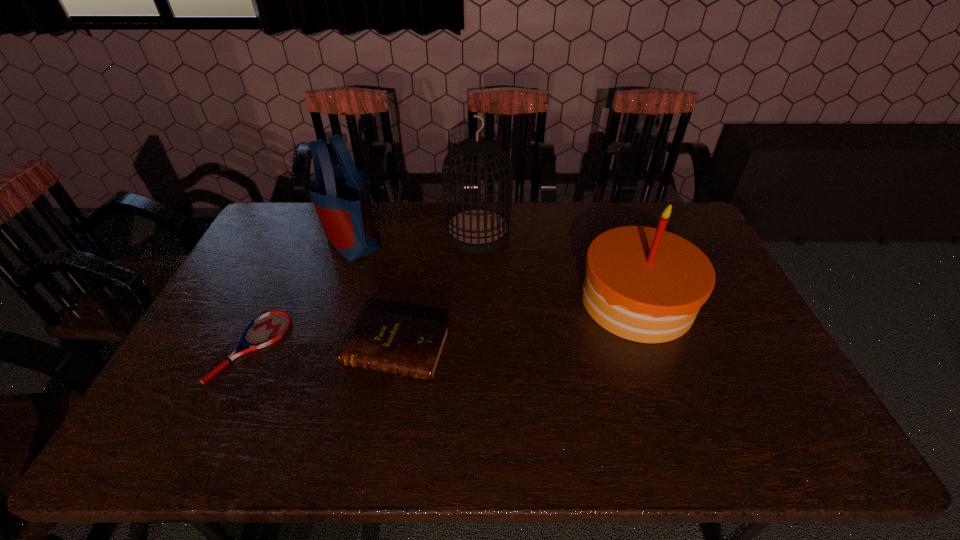
At what (x,y) coordinates should I click in order to perform the action: click on birdcage that is at the far edge. Please return your answer as a coordinate pair (x, y). Image resolution: width=960 pixels, height=540 pixels. Looking at the image, I should click on [479, 230].

This screenshot has height=540, width=960. What are the coordinates of `handbag situated at the far edge` in the screenshot? It's located at click(340, 195).

At what (x,y) coordinates should I click in order to perform the action: click on object situated at the left edge. Please return your answer as a coordinate pair (x, y). Looking at the image, I should click on (266, 329).

I want to click on object that is at the right edge, so click(644, 284).

The width and height of the screenshot is (960, 540). I want to click on free space at the far edge of the desktop, so click(595, 208).

Locate an element on the screen. vacant region at the near edge of the desktop is located at coordinates (458, 424).

In the image, there is a desktop. Where is `vacant space at the left edge`? The image size is (960, 540). vacant space at the left edge is located at coordinates click(x=241, y=369).

Locate an element on the screen. vacant space at the right edge of the desktop is located at coordinates (748, 338).

This screenshot has height=540, width=960. I want to click on vacant area at the far left corner of the desktop, so click(x=300, y=208).

Find the location of `vacant space at the far right corner`. vacant space at the far right corner is located at coordinates (657, 218).